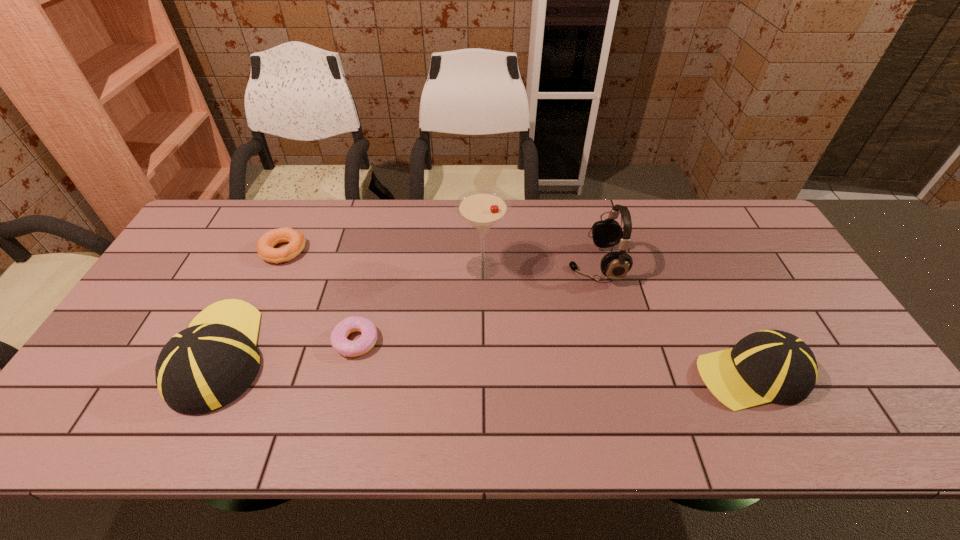
This screenshot has width=960, height=540. I want to click on the left baseball cap, so click(x=208, y=365).

The image size is (960, 540). Identify the location of the taller baseball cap. (208, 365).

Identify the location of the shorter baseball cap. (766, 366).

I want to click on the third shortest object, so [766, 366].

Locate an element on the screen. bagel is located at coordinates (265, 244).

Find the location of a particular element. headset is located at coordinates (606, 233).

What are the coordinates of `the fifth object from left to right` in the screenshot? It's located at (606, 233).

Locate an element on the screen. martini is located at coordinates (482, 209).

Locate an element on the screen. the third object from left to right is located at coordinates pyautogui.click(x=339, y=341).

Where is `free location located with the brim of the third tallest object facing forward`? free location located with the brim of the third tallest object facing forward is located at coordinates (257, 277).